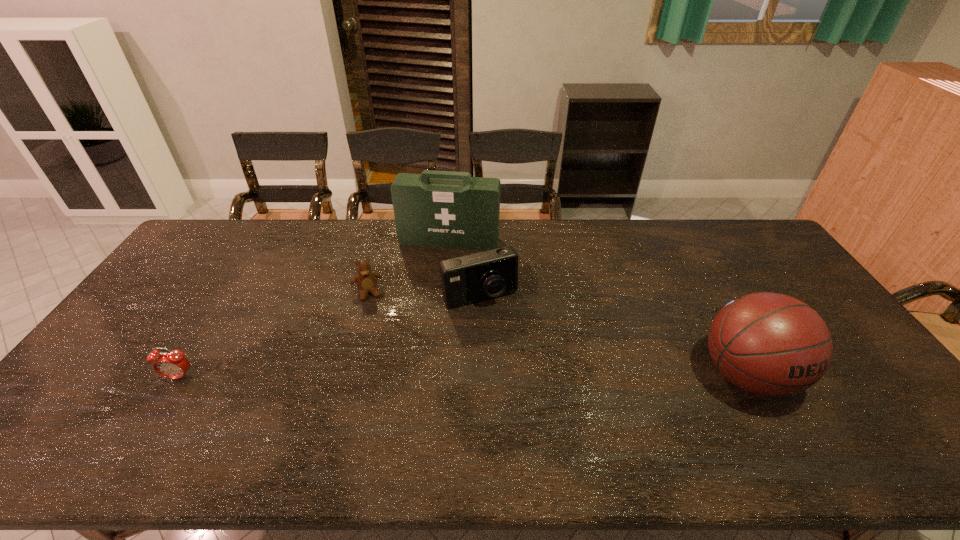
In the image, there is a desktop. Where is `vacant space at the far right corner`? This screenshot has height=540, width=960. vacant space at the far right corner is located at coordinates pyautogui.click(x=725, y=239).

Image resolution: width=960 pixels, height=540 pixels. What are the coordinates of `free space between the third tallest object and the rightmost object` in the screenshot? It's located at (613, 336).

Locate an element on the screen. The width and height of the screenshot is (960, 540). empty space between the fourth object from right to left and the alarm clock is located at coordinates (274, 335).

Image resolution: width=960 pixels, height=540 pixels. Identify the location of vacant space that is in between the alarm clock and the rightmost object. (464, 376).

Find the location of a particular element. The image size is (960, 540). free space between the rightmost object and the teddy bear is located at coordinates (557, 334).

Identify the location of free point between the leftmost object and the teddy bear. This screenshot has width=960, height=540. (274, 335).

Find the location of a particular element. Image resolution: width=960 pixels, height=540 pixels. empty space that is in between the teddy bear and the camera is located at coordinates (423, 295).

This screenshot has width=960, height=540. In order to click on free space between the rightmost object and the first-aid kit in this screenshot , I will do `click(598, 308)`.

This screenshot has height=540, width=960. I want to click on vacant point located between the alarm clock and the farthest object, so click(315, 309).

Where is `free space between the basketball and the first-aid kit`? This screenshot has width=960, height=540. free space between the basketball and the first-aid kit is located at coordinates tap(598, 308).